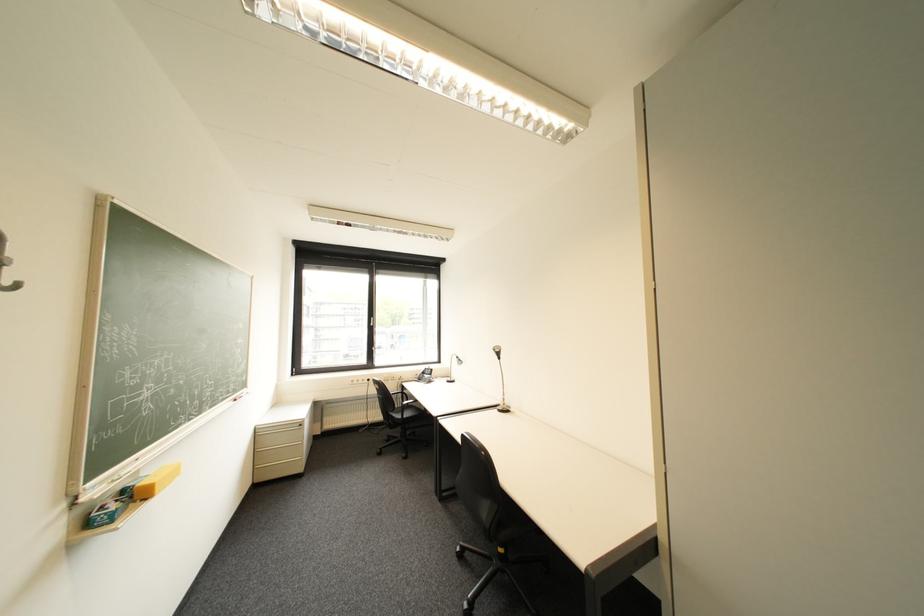
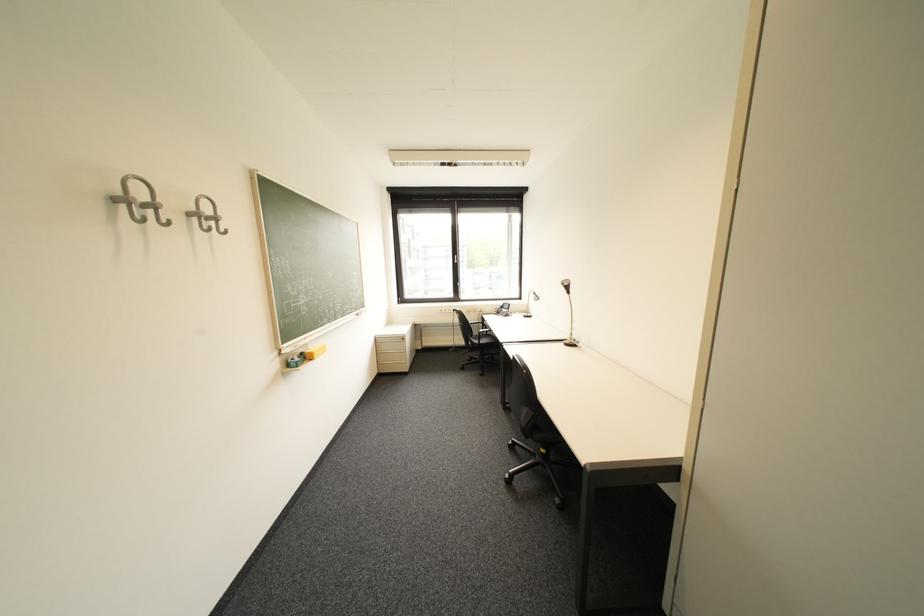
The point at (416, 403) is marked in the first image. Where is the corresponding point in the second image?

(492, 331)